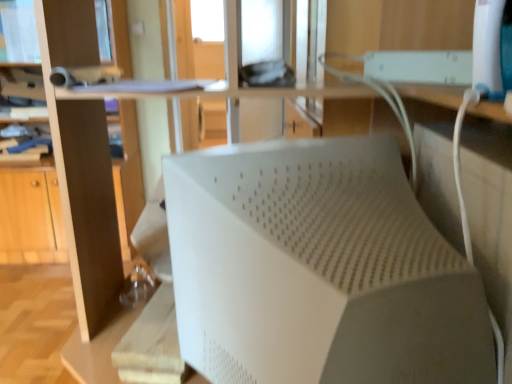
Question: Considering the positions of white matte speaker at center and matte brown bookshelf at left in the image, is white matte speaker at center taller or shorter than matte brown bookshelf at left?

Choices:
 (A) tall
 (B) short

Answer: (B)

Question: Is white matte speaker at center in front of or behind matte brown bookshelf at left in the image?

Choices:
 (A) front
 (B) behind

Answer: (A)

Question: Considering the positions of white matte speaker at center and matte brown bookshelf at left in the image, is white matte speaker at center wider or thinner than matte brown bookshelf at left?

Choices:
 (A) wide
 (B) thin

Answer: (B)

Question: From the image's perspective, is matte brown bookshelf at left positioned above or below white matte speaker at center?

Choices:
 (A) below
 (B) above

Answer: (B)

Question: Does point (76, 240) appear closer or farther from the camera than point (351, 288)?

Choices:
 (A) farther
 (B) closer

Answer: (A)

Question: Is matte brown bookshelf at left taller or shorter than white matte speaker at center?

Choices:
 (A) tall
 (B) short

Answer: (A)

Question: Considering the relative positions of matte brown bookshelf at left and white matte speaker at center in the image provided, is matte brown bookshelf at left to the left or to the right of white matte speaker at center?

Choices:
 (A) left
 (B) right

Answer: (A)